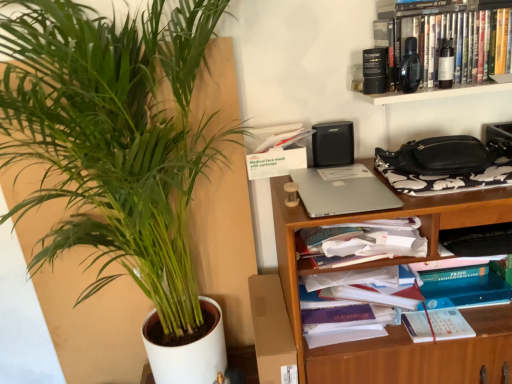
Question: Is wooden bookshelf at center-right, the 1th shelf in the bottom-to-top sequence, in front of or behind silver metallic laptop at center-right in the image?

Choices:
 (A) behind
 (B) front

Answer: (B)

Question: From a real-world perspective, is wooden bookshelf at center-right, the 1th shelf in the bottom-to-top sequence, physically located above or below silver metallic laptop at center-right?

Choices:
 (A) above
 (B) below

Answer: (B)

Question: Which of these objects is positioned farthest from the black matte speaker at upper right?

Choices:
 (A) silver metallic laptop at center-right
 (B) wooden bookshelf at center-right, the 1th shelf in the bottom-to-top sequence
 (C) green leafy plant at left
 (D) black plastic shelf at upper right, acting as the 1th shelf starting from the top

Answer: (C)

Question: Which object is positioned farthest from the black matte speaker at upper right?

Choices:
 (A) black plastic shelf at upper right, acting as the 1th shelf starting from the top
 (B) wooden bookshelf at center-right, marked as the second shelf in a top-to-bottom arrangement
 (C) green leafy plant at left
 (D) silver metallic laptop at center-right

Answer: (C)